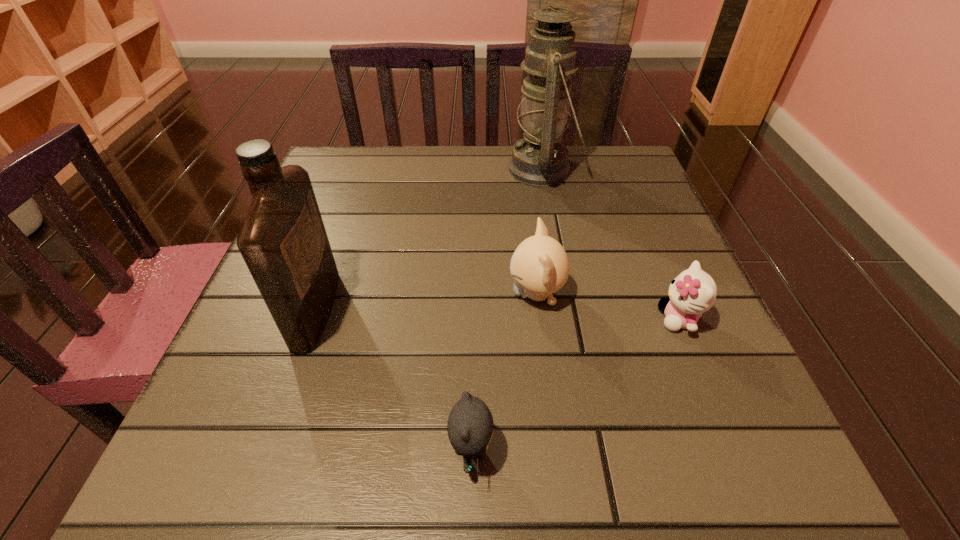
Where is `oil lamp that is at the right edge`? The image size is (960, 540). oil lamp that is at the right edge is located at coordinates (540, 159).

The width and height of the screenshot is (960, 540). I want to click on kitten at the right edge, so click(693, 292).

Locate an element on the screen. object located at the far right corner is located at coordinates (540, 159).

This screenshot has height=540, width=960. In the image, there is a desktop. What are the coordinates of `vacant space at the far edge` in the screenshot? It's located at (399, 157).

The image size is (960, 540). I want to click on free space at the near edge of the desktop, so click(409, 474).

The width and height of the screenshot is (960, 540). I want to click on vacant point at the left edge, so click(346, 275).

Locate an element on the screen. The height and width of the screenshot is (540, 960). vacant area at the right edge is located at coordinates (625, 220).

Locate an element on the screen. This screenshot has width=960, height=540. vacant space at the far left corner of the desktop is located at coordinates (384, 148).

This screenshot has height=540, width=960. What are the coordinates of `free space at the far right corner` in the screenshot? It's located at (586, 151).

I want to click on empty location between the third shortest object and the second object from left to right, so click(504, 372).